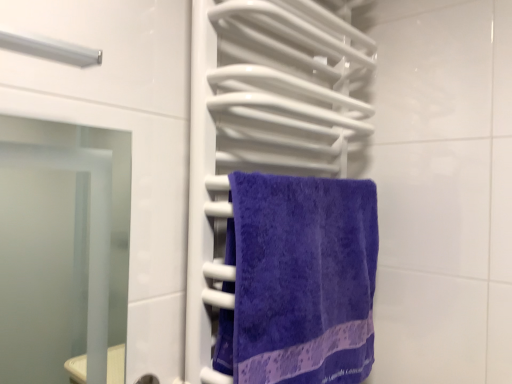
Question: Should I look upward or downward to see purple terry cloth towel at center?

Choices:
 (A) down
 (B) up

Answer: (A)

Question: Is purple terry cloth towel at center facing towards purple soft towel at center?

Choices:
 (A) yes
 (B) no

Answer: (A)

Question: Can you confirm if purple terry cloth towel at center is positioned to the right of purple soft towel at center?

Choices:
 (A) yes
 (B) no

Answer: (A)

Question: Would you consider purple terry cloth towel at center to be distant from purple soft towel at center?

Choices:
 (A) no
 (B) yes

Answer: (A)

Question: From the image's perspective, does purple terry cloth towel at center appear lower than purple soft towel at center?

Choices:
 (A) yes
 (B) no

Answer: (A)

Question: Does purple terry cloth towel at center have a larger size compared to purple soft towel at center?

Choices:
 (A) no
 (B) yes

Answer: (A)

Question: Can you confirm if purple terry cloth towel at center is smaller than purple soft towel at center?

Choices:
 (A) yes
 (B) no

Answer: (A)

Question: Is the depth of purple soft towel at center less than that of purple terry cloth towel at center?

Choices:
 (A) yes
 (B) no

Answer: (A)

Question: From a real-world perspective, is purple soft towel at center under purple terry cloth towel at center?

Choices:
 (A) yes
 (B) no

Answer: (B)

Question: Considering the relative sizes of purple soft towel at center and purple terry cloth towel at center in the image provided, is purple soft towel at center smaller than purple terry cloth towel at center?

Choices:
 (A) yes
 (B) no

Answer: (B)

Question: Is purple soft towel at center not inside purple terry cloth towel at center?

Choices:
 (A) yes
 (B) no

Answer: (A)

Question: Is purple soft towel at center positioned far away from purple terry cloth towel at center?

Choices:
 (A) yes
 (B) no

Answer: (B)

Question: Is purple soft towel at center to the left of purple terry cloth towel at center from the viewer's perspective?

Choices:
 (A) no
 (B) yes

Answer: (B)

Question: Considering the positions of purple terry cloth towel at center and purple soft towel at center in the image, is purple terry cloth towel at center wider or thinner than purple soft towel at center?

Choices:
 (A) thin
 (B) wide

Answer: (A)